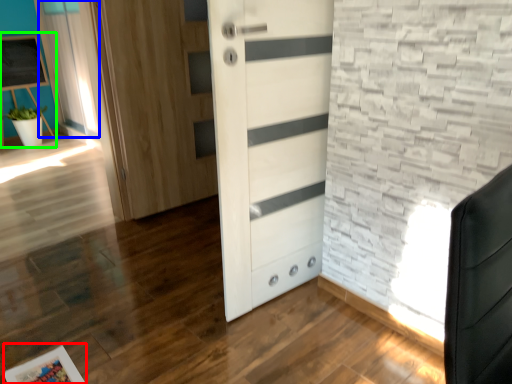
Question: Which is nearer to the picture frame (highlighted by a red box)? curtain (highlighted by a blue box) or bulletin board (highlighted by a green box).

Choices:
 (A) curtain
 (B) bulletin board

Answer: (A)